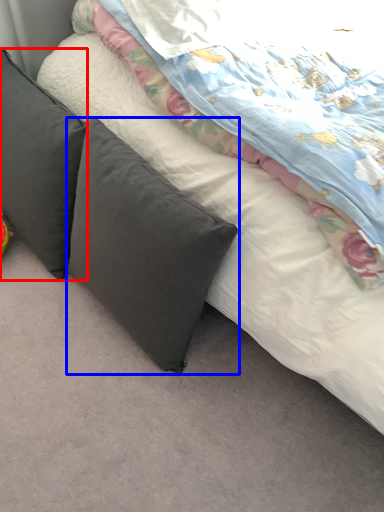
Question: Which object is closer to the camera taking this photo, pillow (highlighted by a red box) or pillow (highlighted by a blue box)?

Choices:
 (A) pillow
 (B) pillow

Answer: (B)